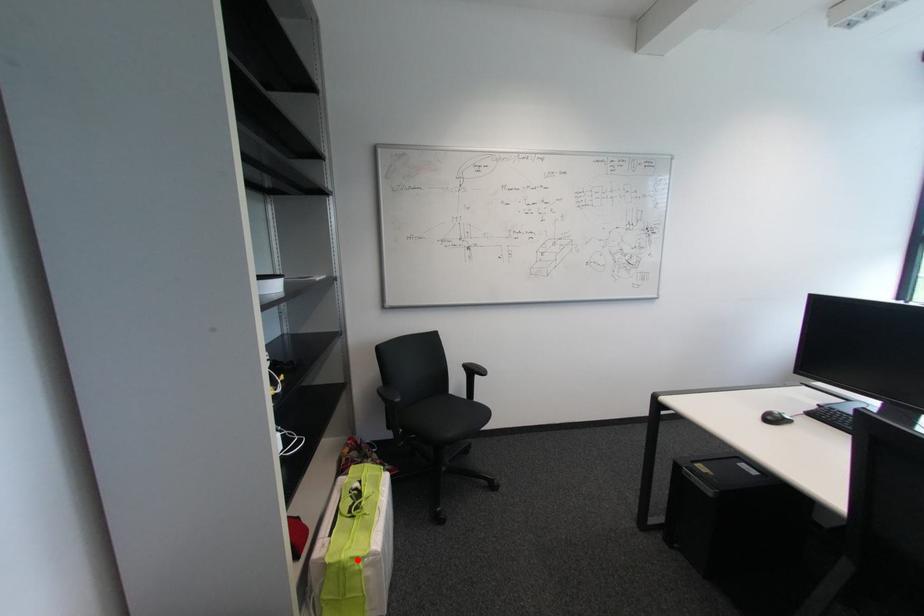
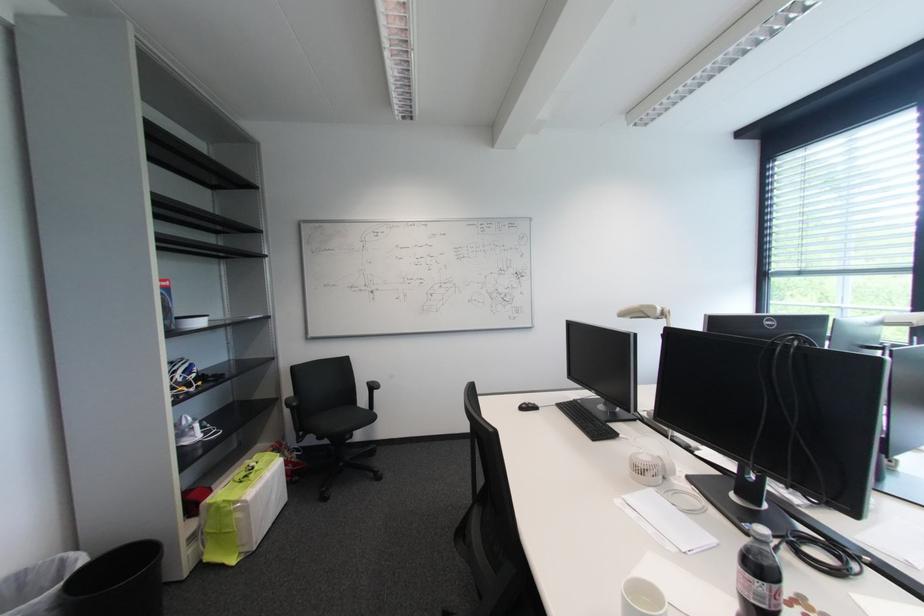
Find the pixel in the second image that matches the highlighted location in the first image.

(231, 503)